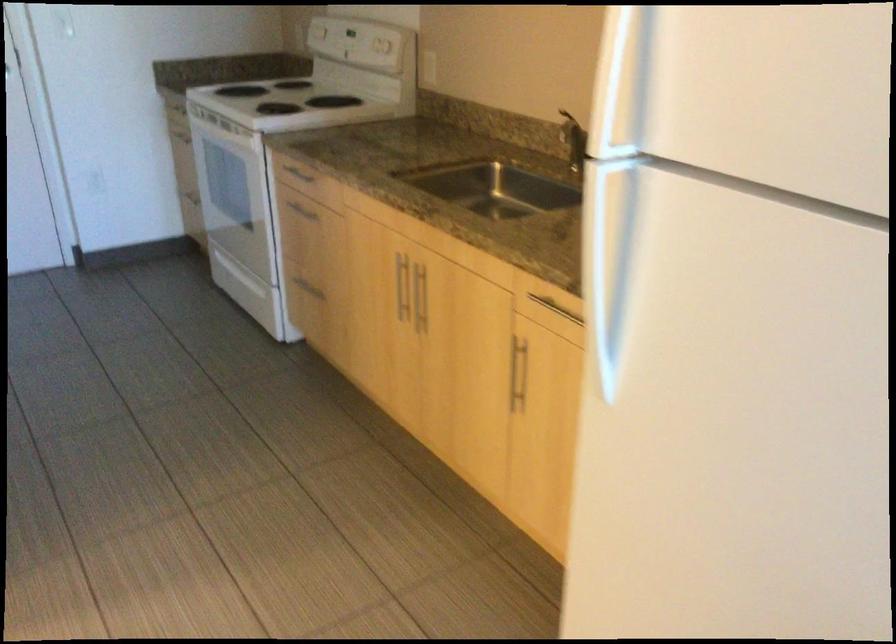
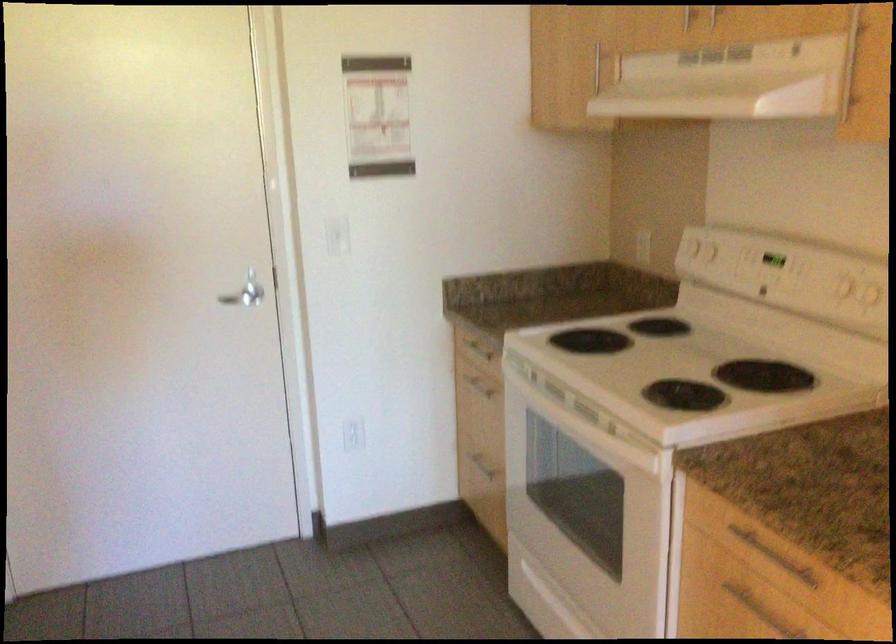
In the second image, find the point that corresponds to [102,185] in the first image.

(352, 433)